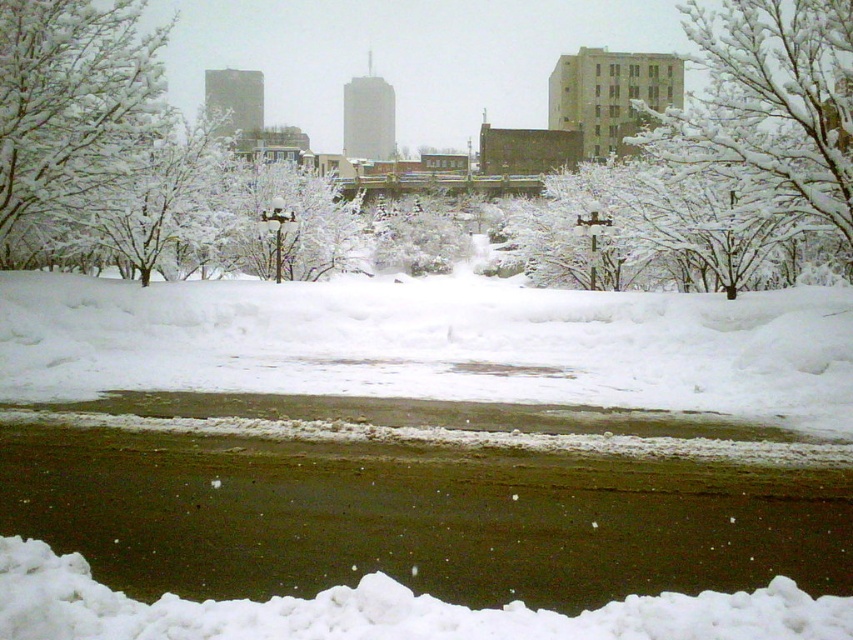
Question: Which point is farther to the camera?

Choices:
 (A) (424, 106)
 (B) (772, 160)
 (C) (16, 250)

Answer: (A)

Question: Among these objects, which one is nearest to the camera?

Choices:
 (A) white frosty branches at upper left
 (B) white fluffy snow at lower center
 (C) snow-covered branches at upper right
 (D) white frosty tree at upper center

Answer: (B)

Question: Is white frosty tree at upper center closer to camera compared to snow-covered branches at upper right?

Choices:
 (A) yes
 (B) no

Answer: (B)

Question: Does white fluffy snow at lower center come in front of white frosty branches at upper left?

Choices:
 (A) yes
 (B) no

Answer: (A)

Question: Does white frosty tree at upper center have a larger size compared to white frosty branches at upper left?

Choices:
 (A) no
 (B) yes

Answer: (B)

Question: Among these objects, which one is nearest to the camera?

Choices:
 (A) white frosty tree at upper center
 (B) white frosty branches at upper left
 (C) white fluffy snow at lower center

Answer: (C)